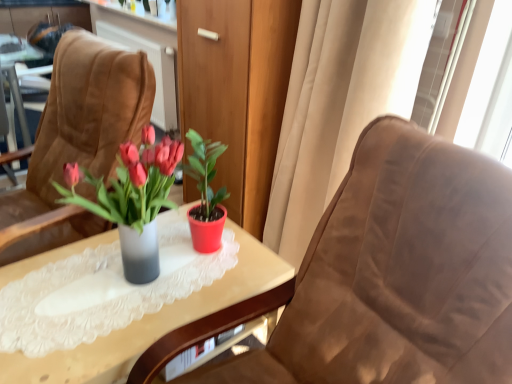
The width and height of the screenshot is (512, 384). Identify the location of spots to the right of matte plastic vase at center. (209, 281).